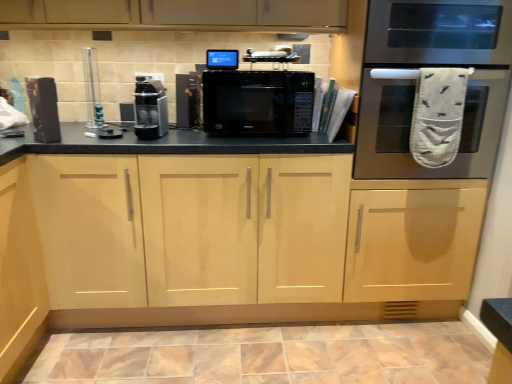
Locate an element on the screen. vacant area that lies in front of satin black coffee machine at center, which appears as the third appliance when viewed from the left is located at coordinates (154, 141).